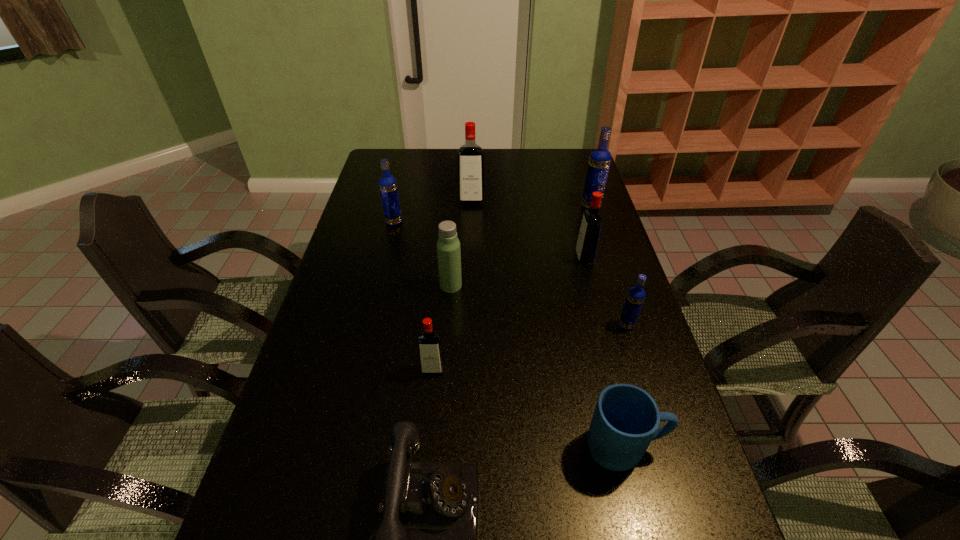
What are the coordinates of `blue vodka that is the closest to the sixth farthest object` in the screenshot? It's located at (600, 158).

At what (x,y) coordinates should I click in order to perform the action: click on red vodka identified as the second closest to the fifth nearest object. Please return your answer as a coordinate pair (x, y). Image resolution: width=960 pixels, height=540 pixels. Looking at the image, I should click on (587, 243).

Select which red vodka is the closest to the biggest red vodka. Please provide its 2D coordinates. Your answer should be formatted as a tuple, i.e. [(x, y)], where the tuple contains the x and y coordinates of a point satisfying the conditions above.

[(587, 243)]

I want to click on blank space that satisfies the following two spatial constraints: 1. on the front and back of the fifth farthest vodka; 2. on the right side of the rightmost red vodka, so click(602, 325).